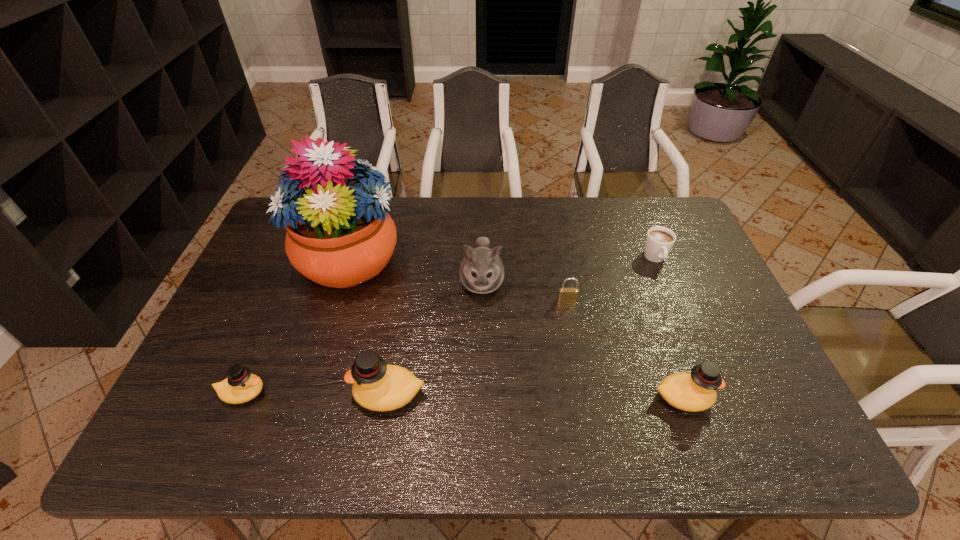
At what (x,y) coordinates should I click in order to perform the action: click on the leftmost duck. Please return your answer as a coordinate pair (x, y). This screenshot has width=960, height=540. Looking at the image, I should click on (241, 386).

The image size is (960, 540). I want to click on the second duck from left to right, so click(x=377, y=386).

Find the location of a particular element. the fourth shortest object is located at coordinates (696, 391).

At what (x,y) coordinates should I click in order to perform the action: click on the second shortest duck. Please return your answer as a coordinate pair (x, y). The height and width of the screenshot is (540, 960). Looking at the image, I should click on point(696,391).

Identify the location of hamster. Image resolution: width=960 pixels, height=540 pixels. (481, 271).

Locate an element on the screen. flower arrangement is located at coordinates (339, 235).

Where is `cappuccino`? This screenshot has height=540, width=960. cappuccino is located at coordinates (659, 241).

Locate an element on the screen. The image size is (960, 540). padlock is located at coordinates (566, 295).

Find the location of a particular element. The height and width of the screenshot is (540, 960). vacant space located 0.060m on the front-facing side of the shortest duck is located at coordinates (292, 393).

At what (x,y) coordinates should I click in order to perform the action: click on vacant position located on the front-facing side of the tallest duck. Please return your answer as a coordinate pair (x, y). Image resolution: width=960 pixels, height=540 pixels. Looking at the image, I should click on (197, 394).